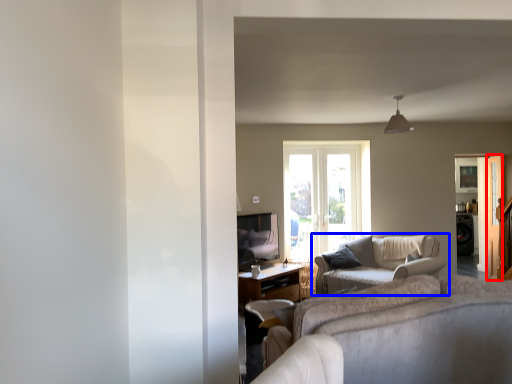
Question: Among these objects, which one is nearest to the camera, screen door (highlighted by a red box) or studio couch (highlighted by a blue box)?

Choices:
 (A) screen door
 (B) studio couch

Answer: (B)